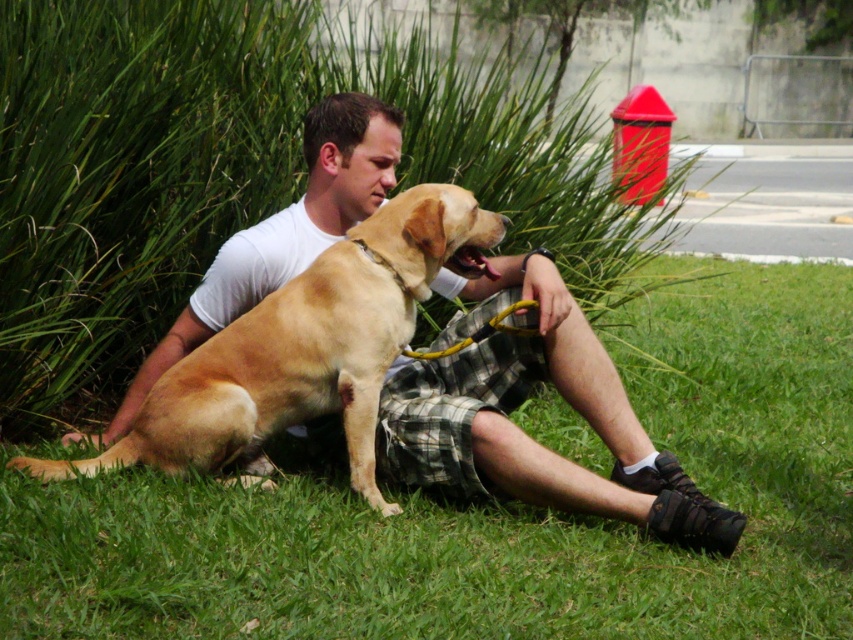
Can you confirm if green grass at lower center is smaller than golden fur dog at center?

Correct, green grass at lower center occupies less space than golden fur dog at center.

Is point (647, 324) positioned in front of point (299, 324)?

No, (647, 324) is further to viewer.

The width and height of the screenshot is (853, 640). I want to click on green grass at lower center, so click(x=494, y=509).

Is point (625, 406) farther from camera compared to point (399, 250)?

Yes, point (625, 406) is farther from viewer.

The width and height of the screenshot is (853, 640). What do you see at coordinates (520, 403) in the screenshot? I see `matte white t-shirt at center` at bounding box center [520, 403].

What do you see at coordinates (520, 403) in the screenshot? This screenshot has width=853, height=640. I see `matte white t-shirt at center` at bounding box center [520, 403].

Identify the location of matte white t-shirt at center. The image size is (853, 640). pos(520,403).

Which is more to the right, green grass at lower center or matte white t-shirt at center?

matte white t-shirt at center is more to the right.

Who is taller, green grass at lower center or matte white t-shirt at center?

matte white t-shirt at center is taller.

Identify the location of green grass at lower center. (494, 509).